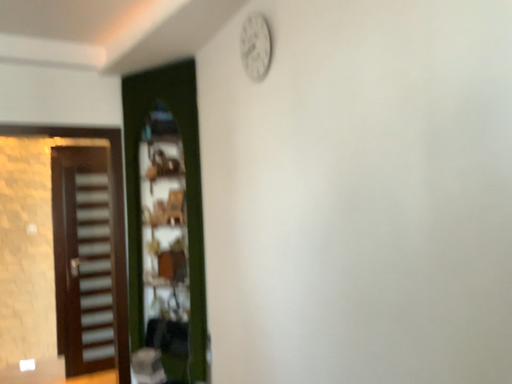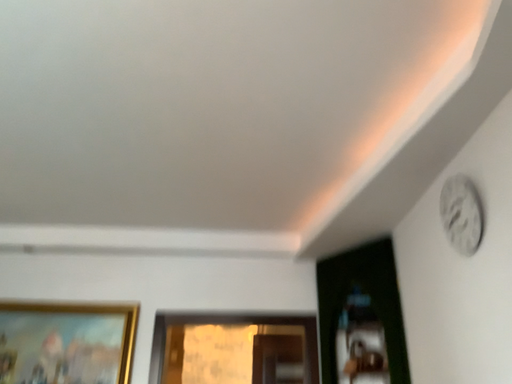
Question: How did the camera likely rotate when shooting the video?

Choices:
 (A) rotated downward
 (B) rotated upward

Answer: (B)